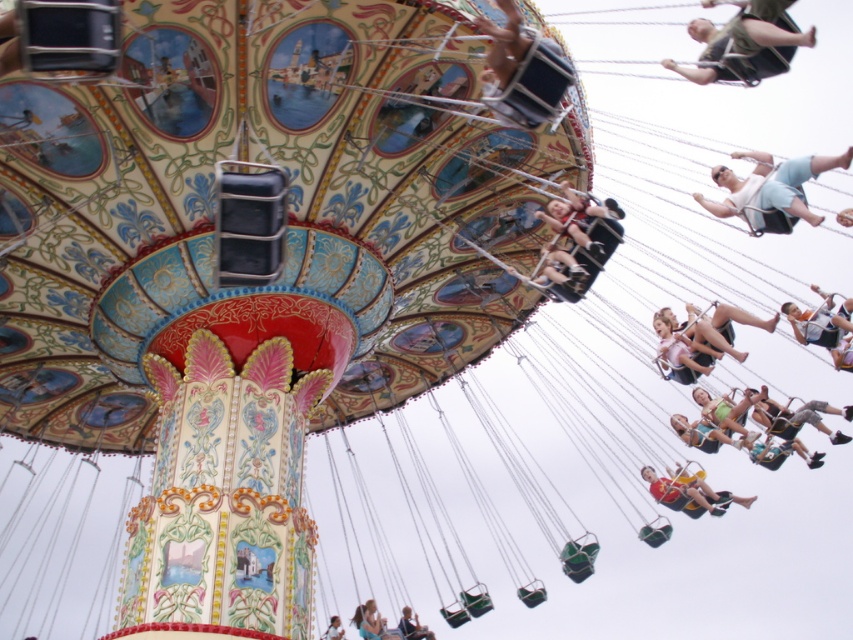
Question: Which point is closer to the camera?

Choices:
 (A) (741, 353)
 (B) (688, 381)
 (C) (567, 296)

Answer: (C)

Question: Observing the image, what is the correct spatial positioning of dark blue jeans at lower right in reference to light brown wooden swing at upper center?

Choices:
 (A) left
 (B) right

Answer: (B)

Question: Which object appears closest to the camera in this image?

Choices:
 (A) light brown wooden swing at upper center
 (B) dark blue jeans at lower right
 (C) black plastic swing at center

Answer: (C)

Question: Does yellow fabric swing at lower right have a larger size compared to light brown wooden swing at upper center?

Choices:
 (A) no
 (B) yes

Answer: (B)

Question: Which of the following is the farthest from the observer?

Choices:
 (A) (561, 186)
 (B) (810, 413)

Answer: (B)

Question: Does yellow fabric swing at lower right appear under light blue denim jeans at lower center?

Choices:
 (A) yes
 (B) no

Answer: (B)